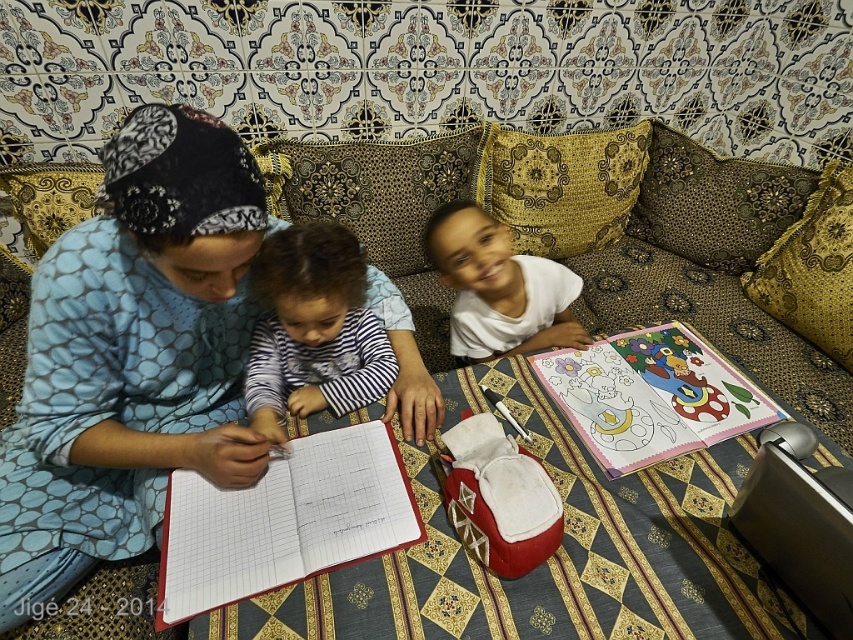
You are a photographer trying to capture a candid shot of the two people sitting on the sofa. You want to ensure that both the blue dotted dress at center and the striped fabric shirt at center are clearly visible in the frame. Given their distance apart, do you think you can fit both into your camera viewfinder without moving closer or farther away?

The blue dotted dress at center and the striped fabric shirt at center are 5.61 inches apart. Since this distance is relatively small, it should be possible to capture both in the same frame without adjusting your position, provided the camera has a wide enough lens to accommodate the 5.61 inches between them.

You are standing in the living room and want to take a photo of the striped fabric shirt at center. If your camera can focus on objects within 36 inches, will you need to move closer or farther away?

The striped fabric shirt at center is 37.23 inches away from the camera, which is beyond the camera focus range of 36 inches. You need to move closer to ensure it is within the focus range.